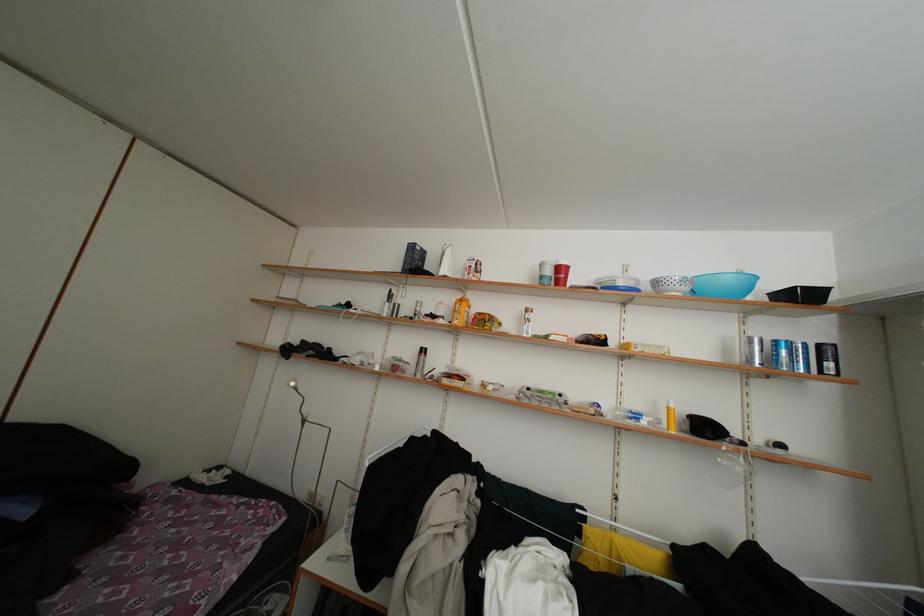
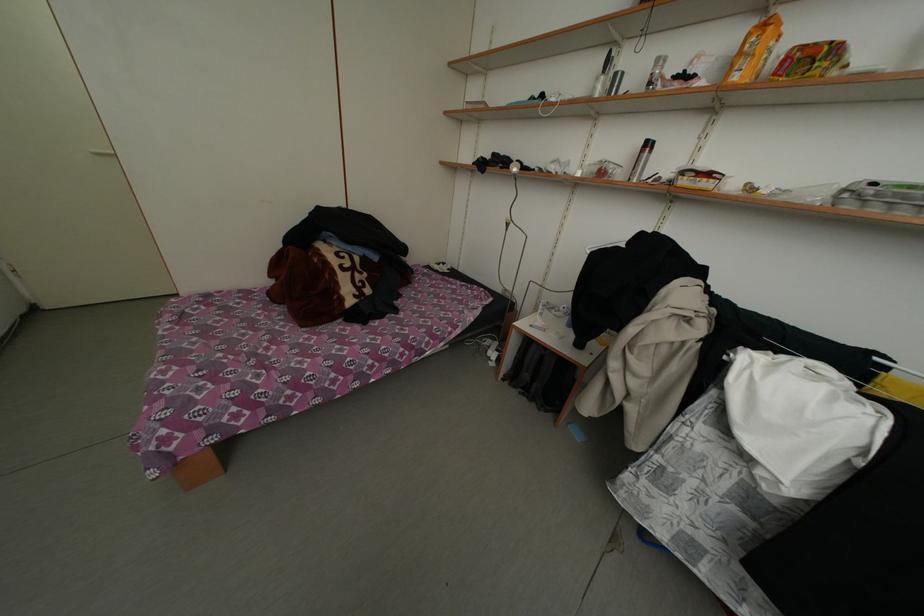
In the second image, find the point that corresponds to (x=537, y=394) in the first image.

(881, 188)